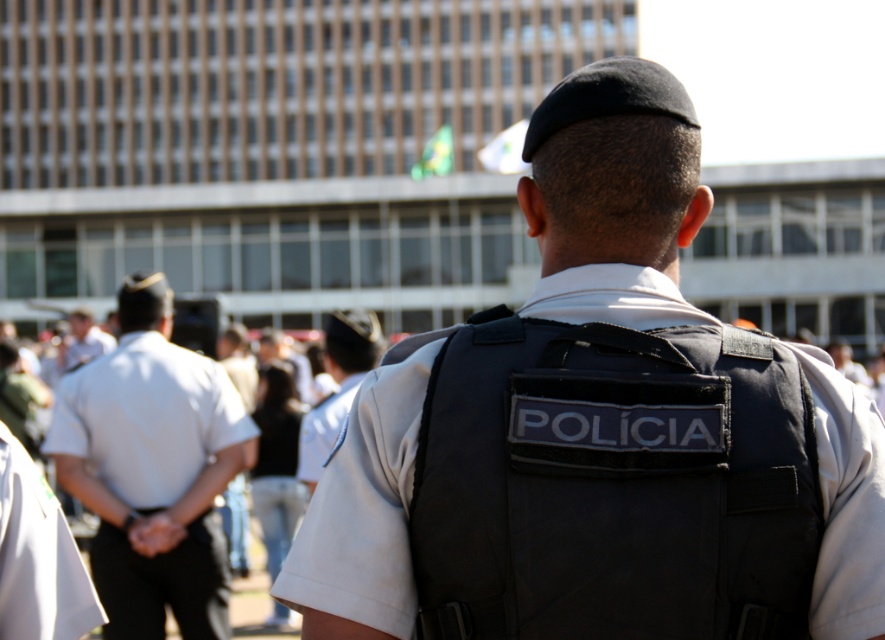
Does black fabric vest at center have a lesser width compared to white uniform at center?

Yes.

Locate an element on the screen. This screenshot has height=640, width=885. black fabric vest at center is located at coordinates pos(613,484).

In order to click on black fabric vest at center in this screenshot , I will do `click(613, 484)`.

What are the coordinates of `black fabric vest at center` in the screenshot? It's located at (613, 484).

Can you confirm if white uniform shirt at center is positioned to the left of white fabric shirt at center?

Yes, white uniform shirt at center is to the left of white fabric shirt at center.

Which is in front, point (205, 604) or point (314, 465)?

Point (205, 604) is more forward.

Identify the location of white uniform shirt at center. This screenshot has width=885, height=640. (151, 468).

Does point (163, 275) lie behind point (73, 316)?

Yes.

Does white uniform shirt at center come in front of light brown leather jacket at left?

Yes, it is in front of light brown leather jacket at left.

Where is `white uniform shirt at center`? This screenshot has height=640, width=885. white uniform shirt at center is located at coordinates (151, 468).